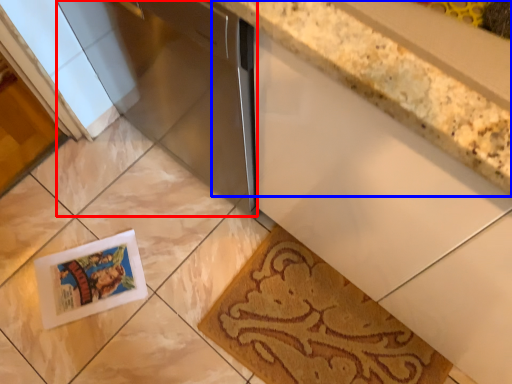
Question: Which of the following is the farthest to the observer, appliance (highlighted by a red box) or countertop (highlighted by a blue box)?

Choices:
 (A) appliance
 (B) countertop

Answer: (A)